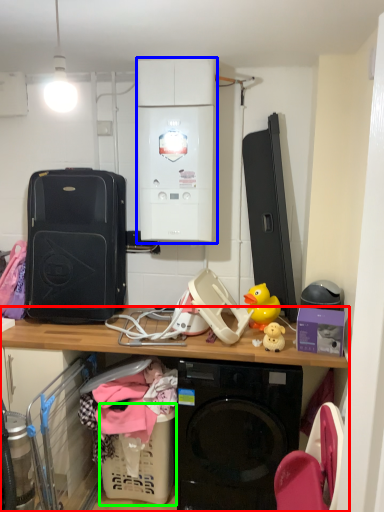
Question: Considering the real-world distances, which object is farthest from desk (highlighted by a red box)? appliance (highlighted by a blue box) or basket (highlighted by a green box)?

Choices:
 (A) appliance
 (B) basket

Answer: (A)